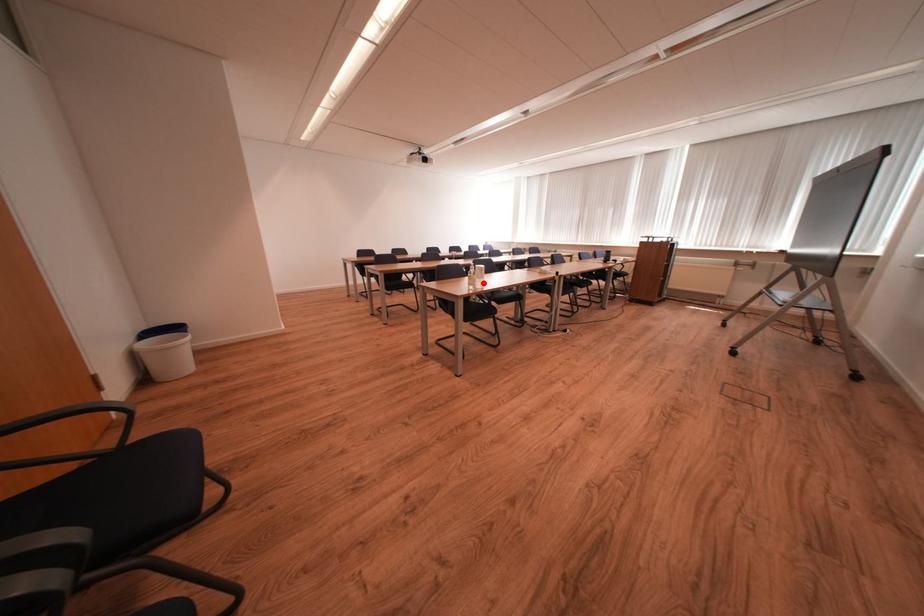
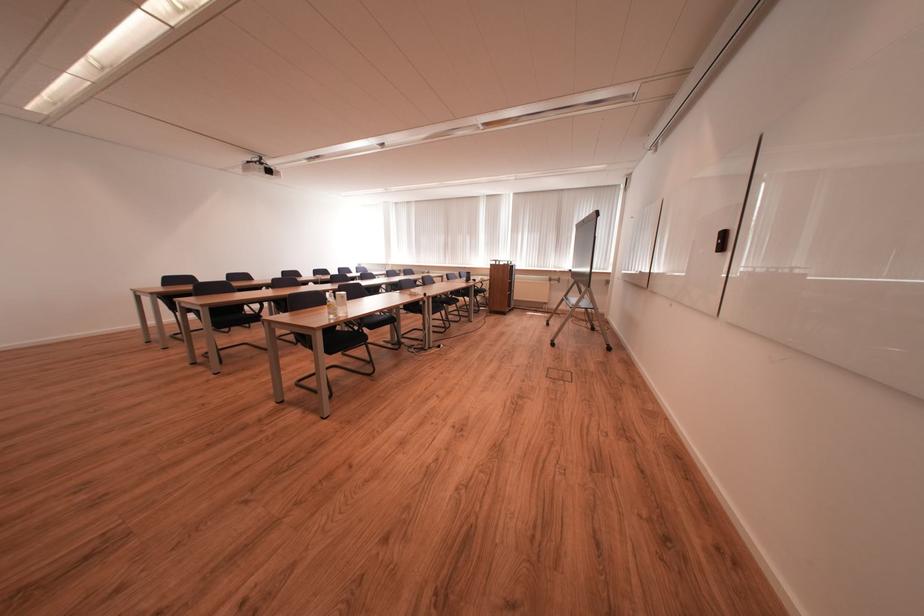
Question: I am providing you with two images of the same scene from different viewpoints. A red point is marked on the first image. At the location where the point appears in image 1, is it still visible in image 2?

Choices:
 (A) Yes
 (B) No

Answer: (A)